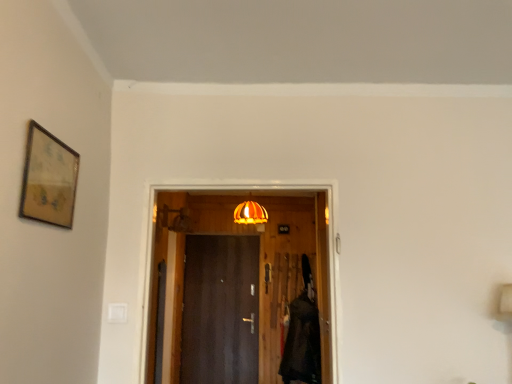
Where is `free spot above wooden door at center, which ranks as the first door in top-to-bottom order (from a real-world perspective)`? free spot above wooden door at center, which ranks as the first door in top-to-bottom order (from a real-world perspective) is located at coordinates (231, 181).